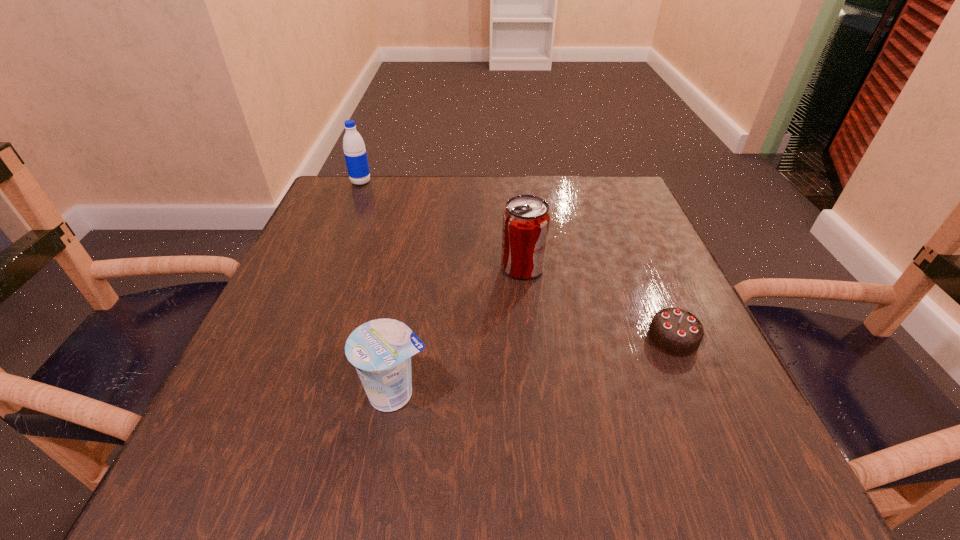
Find the location of a particular element. free space located on the front of the third tallest object is located at coordinates point(383,469).

This screenshot has width=960, height=540. Find the location of `vacant region located 0.090m on the left of the chocolate cake`. vacant region located 0.090m on the left of the chocolate cake is located at coordinates (595, 338).

Where is `object that is at the far edge`? This screenshot has width=960, height=540. object that is at the far edge is located at coordinates (355, 153).

Where is `object at the left edge`? object at the left edge is located at coordinates coord(355,153).

Locate an element on the screen. This screenshot has height=540, width=960. object located at the right edge is located at coordinates click(x=674, y=331).

You are a GUI agent. You are given a task and a screenshot of the screen. Output one action in this format:
    pyautogui.click(x=<x>, y=<y>)
    Task: Click on the object situated at the far left corner
    The image size is (960, 540).
    Given the screenshot: What is the action you would take?
    pyautogui.click(x=355, y=153)

I want to click on vacant space at the far edge of the desktop, so (x=501, y=191).

In order to click on vacant area at the near edge of the desktop in this screenshot , I will do `click(480, 480)`.

The image size is (960, 540). In order to click on free space at the left edge in this screenshot , I will do `click(277, 298)`.

The width and height of the screenshot is (960, 540). I want to click on vacant point at the right edge, so click(x=659, y=265).